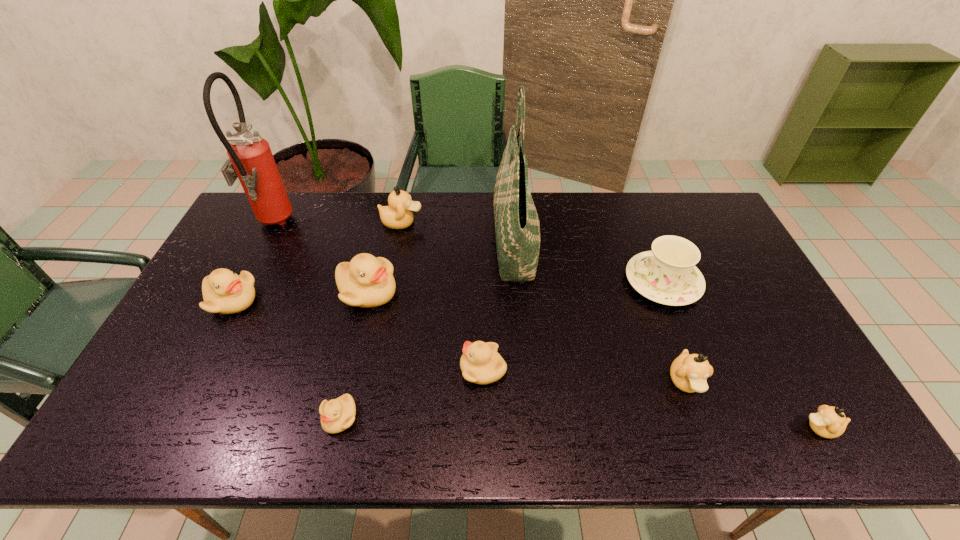
You are a GUI agent. You are given a task and a screenshot of the screen. Output one action in this format:
    pyautogui.click(x=<x>, y=<y>)
    Task: Click on the third duckling from right to left
    The image size is (960, 540).
    Given the screenshot: What is the action you would take?
    pyautogui.click(x=480, y=363)

Locate an element on the screen. the second nearest yellow duckling is located at coordinates (480, 363).

I want to click on the rightmost tan duckling, so click(829, 422).

In order to click on the nearest tan duckling in this screenshot , I will do 829,422.

Identify the location of the shortest duckling. (338, 414).

Where is `the smallest yellow duckling`? Image resolution: width=960 pixels, height=540 pixels. the smallest yellow duckling is located at coordinates (338, 414).

Image resolution: width=960 pixels, height=540 pixels. Identify the location of free location located 0.390m on the left of the green tote bag. (376, 242).

This screenshot has height=540, width=960. Identify the location of vacant space located 0.380m at the nozzle of the fire extinguisher. coord(400,225).

Where is `vacant space located 0.060m on the face of the farthest duckling`? The image size is (960, 540). vacant space located 0.060m on the face of the farthest duckling is located at coordinates (441, 222).

Image resolution: width=960 pixels, height=540 pixels. I want to click on vacant space situated 0.400m on the beak of the biggest yellow duckling, so click(x=531, y=292).